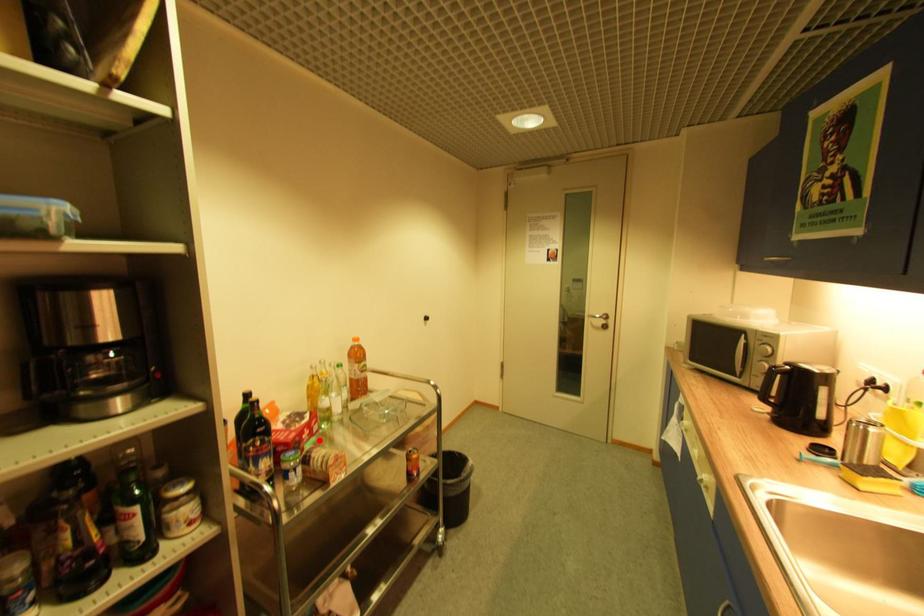
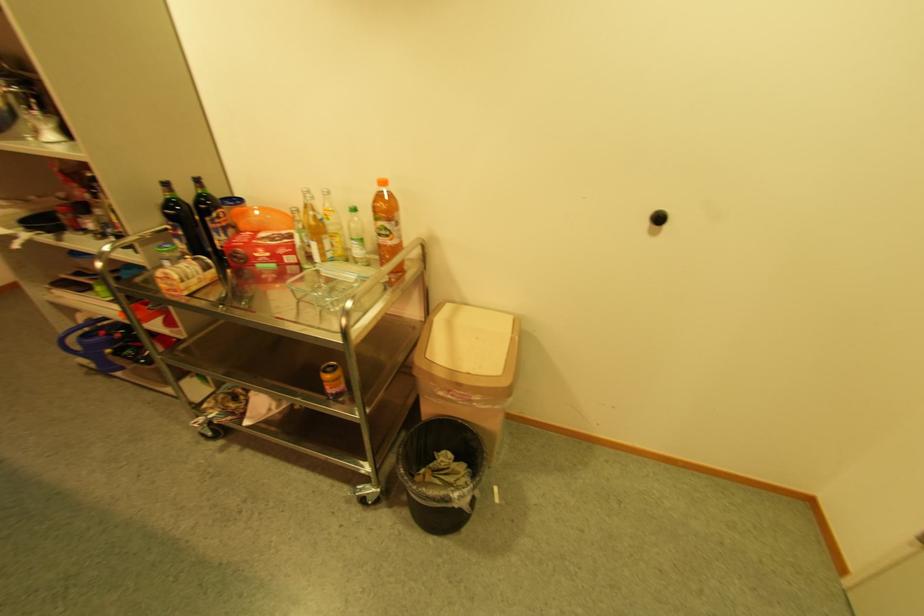
Find the pixel in the second image that matches the highlighted location in the first image.

(278, 267)